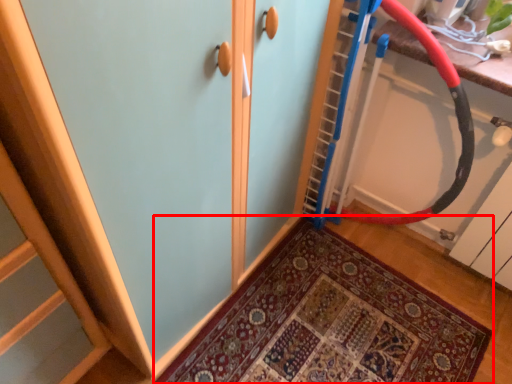
Question: Where is door (annotated by the red box) located in relation to battle rope in the image?

Choices:
 (A) left
 (B) right

Answer: (A)